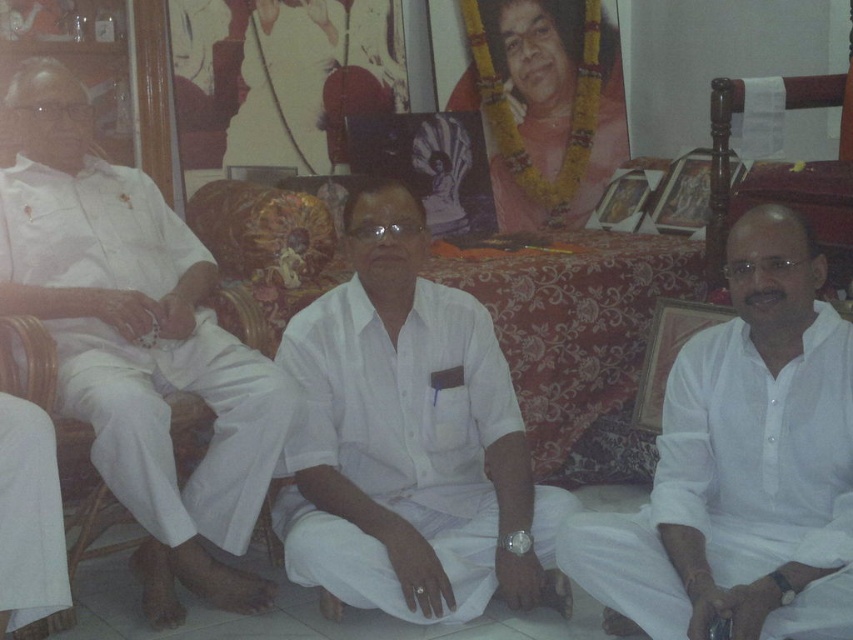
Does point (469, 384) come closer to viewer compared to point (735, 310)?

Yes, it is.

Consider the image. Between white cotton shirt at center and white cotton shirt at right, which one is positioned lower?

white cotton shirt at right is below.

Who is more distant from viewer, [339,403] or [722,384]?

Positioned behind is point [339,403].

Find the location of a particular element. white cotton shirt at center is located at coordinates (408, 440).

Is white cotton kurta at left above white cotton robe at lower left?

Indeed, white cotton kurta at left is positioned over white cotton robe at lower left.

Does white cotton kurta at left have a smaller size compared to white cotton robe at lower left?

Actually, white cotton kurta at left might be larger than white cotton robe at lower left.

The height and width of the screenshot is (640, 853). What do you see at coordinates (137, 342) in the screenshot?
I see `white cotton kurta at left` at bounding box center [137, 342].

Locate an element on the screen. Image resolution: width=853 pixels, height=640 pixels. white cotton kurta at left is located at coordinates (137, 342).

Is white cotton shirt at right thinner than white cotton robe at lower left?

In fact, white cotton shirt at right might be wider than white cotton robe at lower left.

Is white cotton shirt at right below white cotton robe at lower left?

No.

Which is behind, point (763, 330) or point (42, 429)?

The point (763, 330) is behind.

Identify the location of white cotton shirt at right. (741, 465).